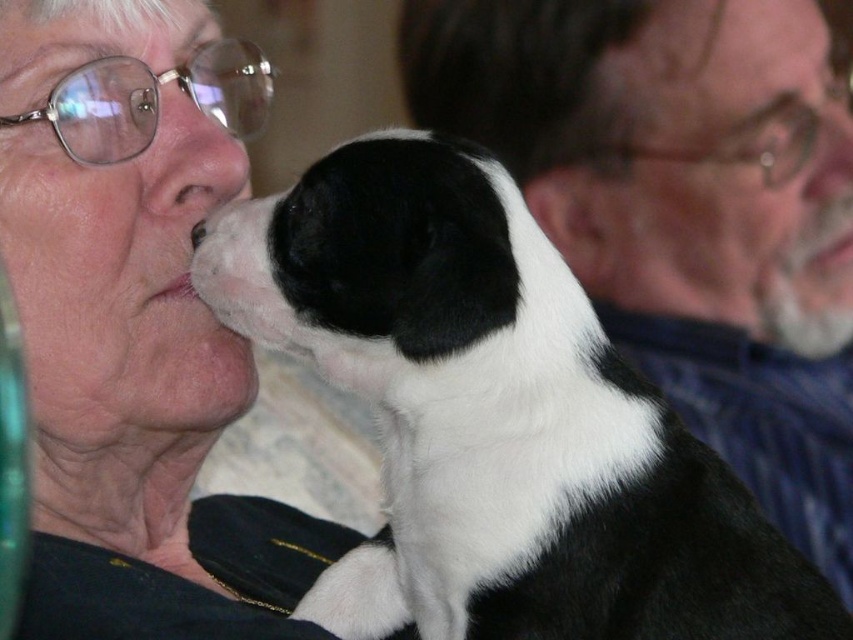
Question: Which of the following is the farthest from the observer?

Choices:
 (A) (148, 157)
 (B) (724, 579)
 (C) (96, 243)

Answer: (A)

Question: Is black and white fur at center positioned behind matte black jacket at upper left?

Choices:
 (A) yes
 (B) no

Answer: (B)

Question: Among these points, which one is nearest to the camera?

Choices:
 (A) (192, 196)
 (B) (335, 179)
 (C) (70, 216)

Answer: (B)

Question: Does matte black jacket at upper left have a greater width compared to matte black nose at upper left?

Choices:
 (A) no
 (B) yes

Answer: (B)

Question: In this image, where is matte black jacket at upper left located relative to matte black nose at upper left?

Choices:
 (A) above
 (B) below

Answer: (B)

Question: Which object is closer to the camera taking this photo?

Choices:
 (A) black and white fur at center
 (B) matte black jacket at upper left
 (C) matte black nose at upper left

Answer: (A)